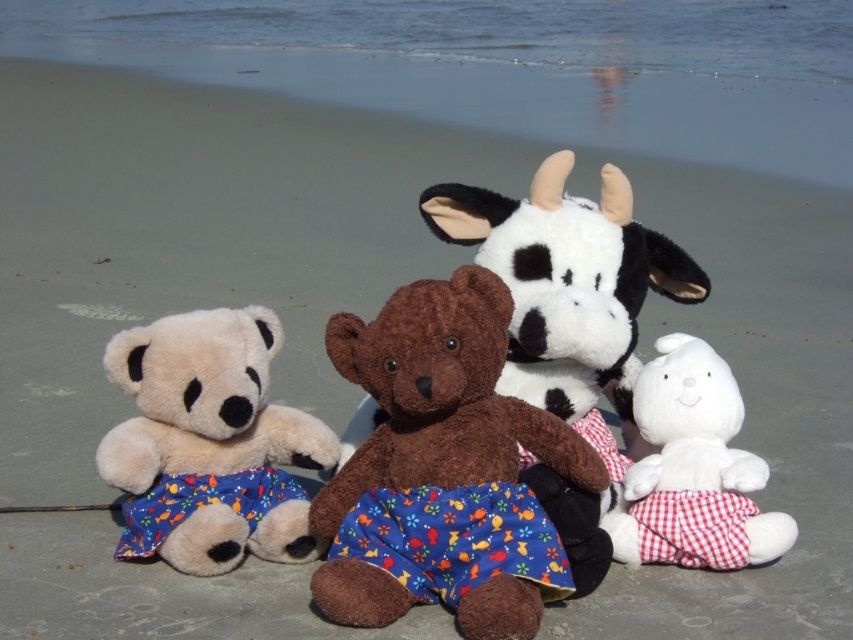
From the picture: You are a child who wants to place a new toy between the brown plush bear at center and the fluffy beige teddy bear at left. The new toy is 12 inches long. Can it fit between them without overlapping?

The distance between the brown plush bear at center and the fluffy beige teddy bear at left is 11.92 inches. Since the new toy is 12 inches long, it would not fit between them without overlapping.

You are standing at the origin point of the coordinate system where the image is displayed. The brown plush bear at center is located at point 0.623, 0.517. If you want to walk directly towards it, which direction should you move in terms of x and y coordinates?

To reach the brown plush bear at center located at coordinates (440, 397) from the origin, you should move in the positive x and positive y direction since both coordinates are greater than zero.

You are standing at the origin point of the coordinate system. You want to walk straight towards the brown plush bear at center. What direction should you head in?

Since the brown plush bear at center is located at coordinates approximately 0.623 on the x axis and 0.517 on the y axis, you should head northeast to reach it.